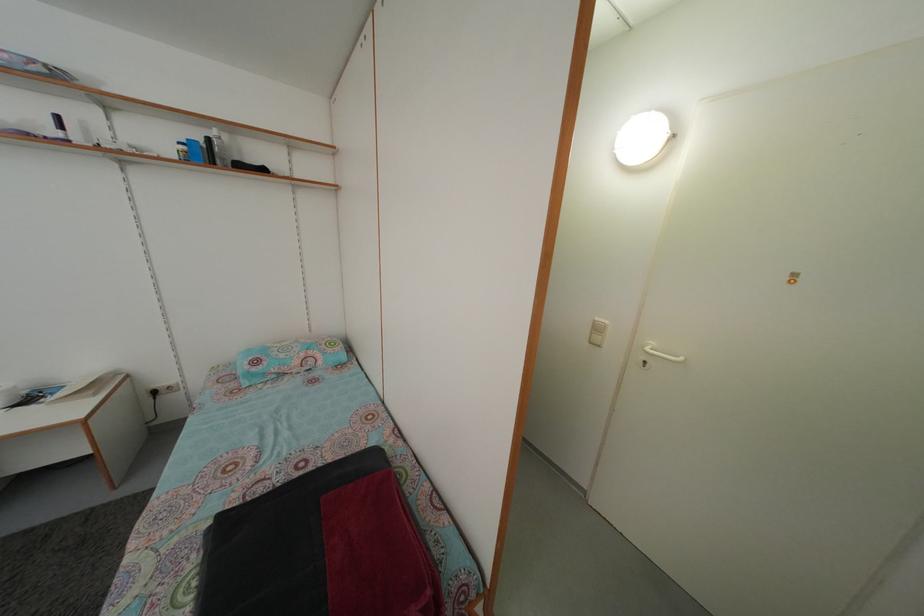
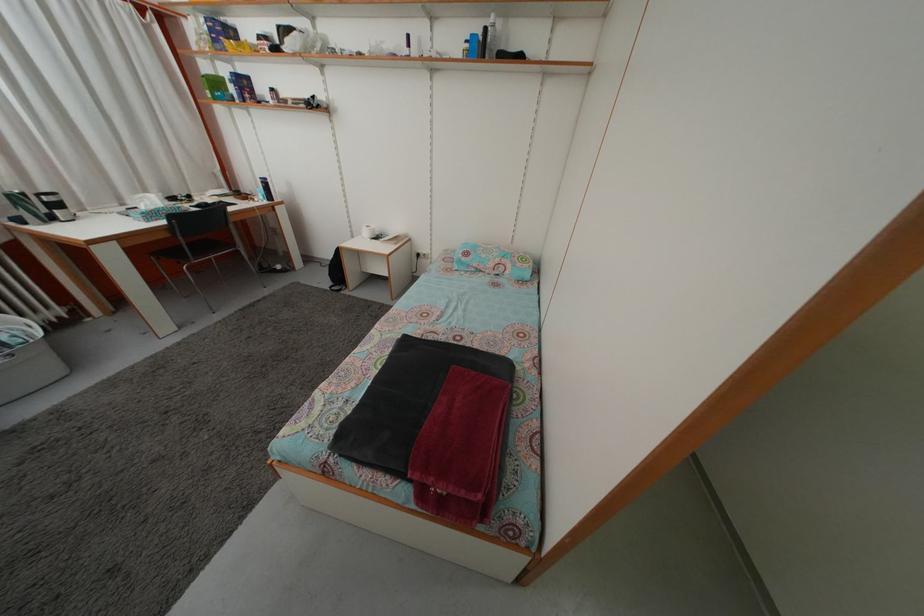
Where in the second image is the point corresponding to (x=189, y=155) from the first image?

(473, 53)